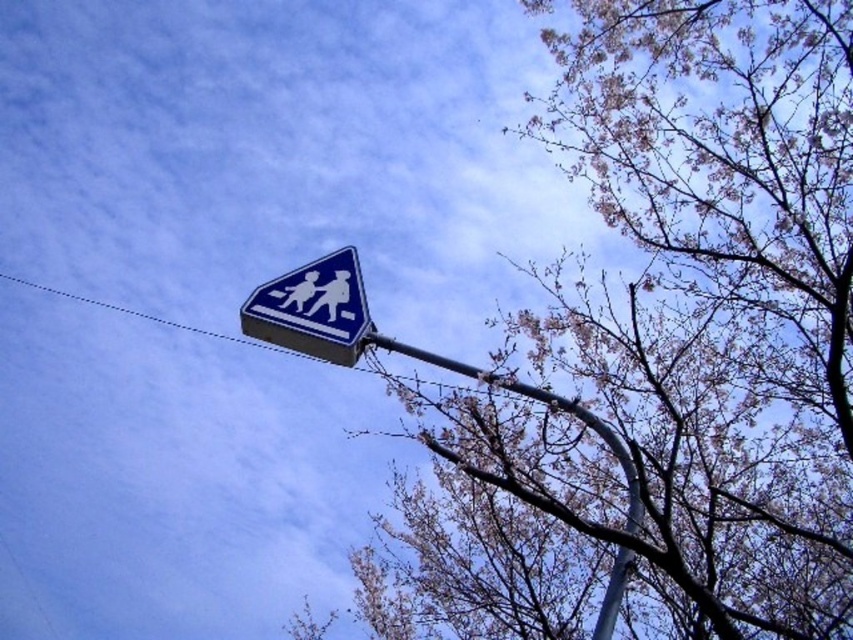
Question: Is bare branches at upper center positioned at the back of blue glossy pedestrian crossing sign at upper center?

Choices:
 (A) yes
 (B) no

Answer: (B)

Question: Considering the relative positions of blue glossy pedestrian crossing sign at upper center and metallic gray pole at upper center in the image provided, where is blue glossy pedestrian crossing sign at upper center located with respect to metallic gray pole at upper center?

Choices:
 (A) right
 (B) left

Answer: (B)

Question: Which point is closer to the camera taking this photo?

Choices:
 (A) (630, 518)
 (B) (309, 352)

Answer: (A)

Question: Considering the real-world distances, which object is closest to the metallic gray pole at upper center?

Choices:
 (A) bare branches at upper center
 (B) blue glossy pedestrian crossing sign at upper center

Answer: (A)

Question: Does bare branches at upper center appear on the left side of metallic gray pole at upper center?

Choices:
 (A) no
 (B) yes

Answer: (A)

Question: Which point is closer to the camera?

Choices:
 (A) (596, 621)
 (B) (328, 298)
 (C) (813, 317)

Answer: (A)